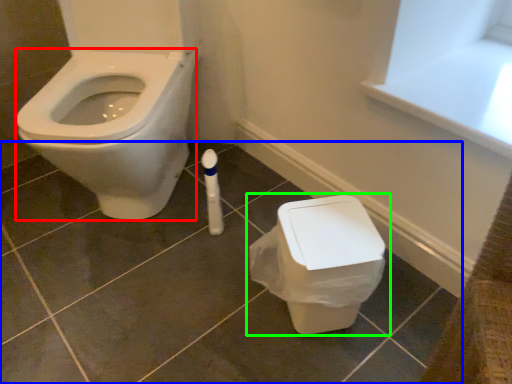
Question: Considering the real-world distances, which object is farthest from bidet (highlighted by a red box)? tile (highlighted by a blue box) or toilet (highlighted by a green box)?

Choices:
 (A) tile
 (B) toilet

Answer: (B)